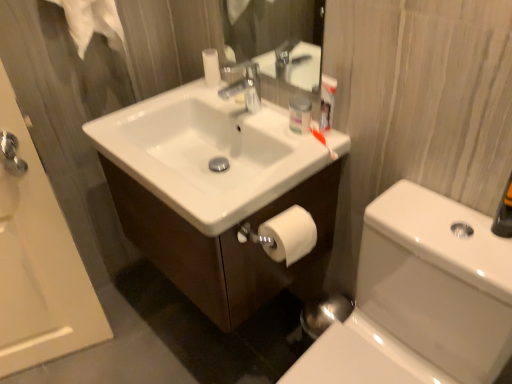
Question: Does white glossy cabinet at center contain white glossy toilet bowl at lower right?

Choices:
 (A) yes
 (B) no

Answer: (B)

Question: Are white glossy cabinet at center and white glossy toilet bowl at lower right far apart?

Choices:
 (A) yes
 (B) no

Answer: (B)

Question: From the image's perspective, is white glossy cabinet at center located beneath white glossy toilet bowl at lower right?

Choices:
 (A) no
 (B) yes

Answer: (A)

Question: Can you confirm if white glossy cabinet at center is shorter than white glossy toilet bowl at lower right?

Choices:
 (A) no
 (B) yes

Answer: (B)

Question: From a real-world perspective, is white glossy cabinet at center located beneath white glossy toilet bowl at lower right?

Choices:
 (A) yes
 (B) no

Answer: (B)

Question: Is white glossy cabinet at center taller than white glossy toilet bowl at lower right?

Choices:
 (A) yes
 (B) no

Answer: (B)

Question: Considering the relative sizes of matte plastic container at upper center and white glossy cabinet at center in the image provided, is matte plastic container at upper center shorter than white glossy cabinet at center?

Choices:
 (A) yes
 (B) no

Answer: (A)

Question: Is matte plastic container at upper center bigger than white glossy cabinet at center?

Choices:
 (A) no
 (B) yes

Answer: (A)

Question: Does matte plastic container at upper center have a greater width compared to white glossy cabinet at center?

Choices:
 (A) no
 (B) yes

Answer: (A)

Question: Is matte plastic container at upper center outside of white glossy cabinet at center?

Choices:
 (A) no
 (B) yes

Answer: (B)

Question: Can white glossy cabinet at center be found inside matte plastic container at upper center?

Choices:
 (A) no
 (B) yes

Answer: (A)

Question: From the image's perspective, does matte plastic container at upper center appear higher than white glossy cabinet at center?

Choices:
 (A) no
 (B) yes

Answer: (B)

Question: Is white matte toilet paper at lower right facing away from white glossy cabinet at center?

Choices:
 (A) yes
 (B) no

Answer: (A)